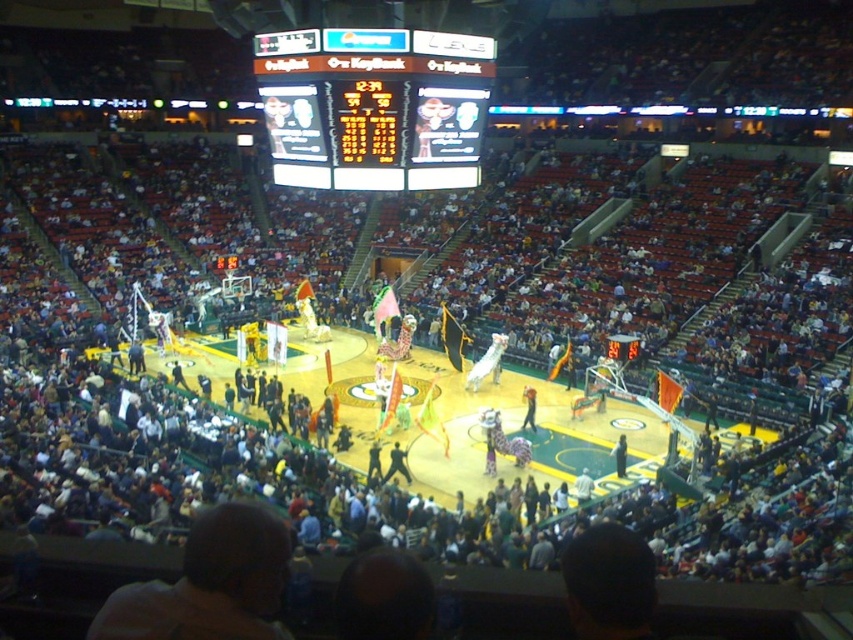
You are a photographer planning to capture a wide shot of the basketball arena. You need to ensure both the white plastic scoreboard at upper center and the metallic scoreboard at center are clearly visible. Based on their sizes, which scoreboard should you prioritize framing closer to the camera to ensure it doesn t appear too small in the photo?

The white plastic scoreboard at upper center has a larger width than the metallic scoreboard at center. To ensure both are clearly visible, prioritize framing the metallic scoreboard at center closer to the camera since it is smaller and needs to be magnified slightly to match the visibility of the larger one.

You are a drone operator trying to capture aerial footage of the basketball arena. Your drone can only fly up to 30 meters from its starting position. If you start at the white plastic scoreboard at upper center, can you reach the metallic scoreboard at center without exceeding the drone flight limit?

The white plastic scoreboard at upper center and metallic scoreboard at center are 31.20 meters apart. Since the drone can only fly up to 30 meters, it cannot reach the metallic scoreboard at center without exceeding its flight limit.